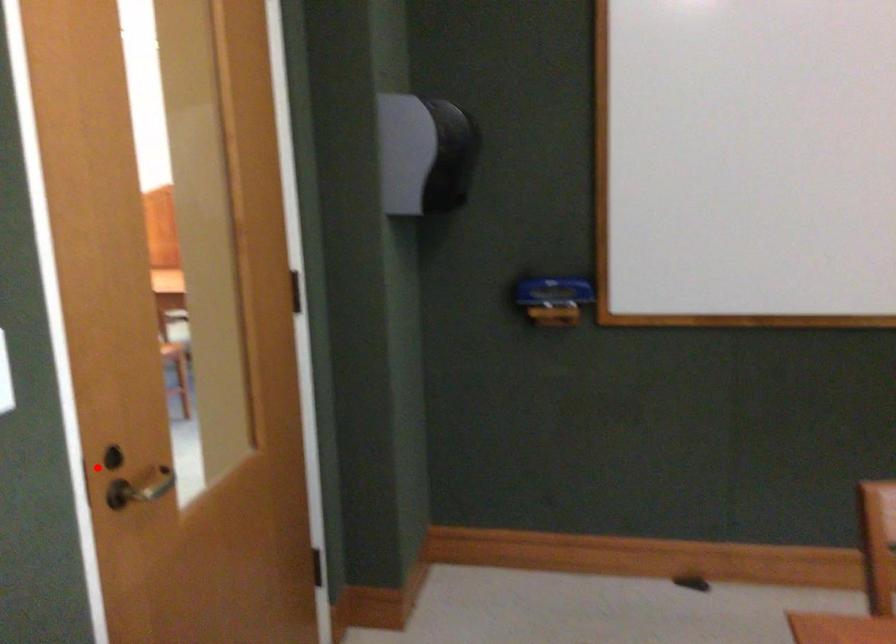
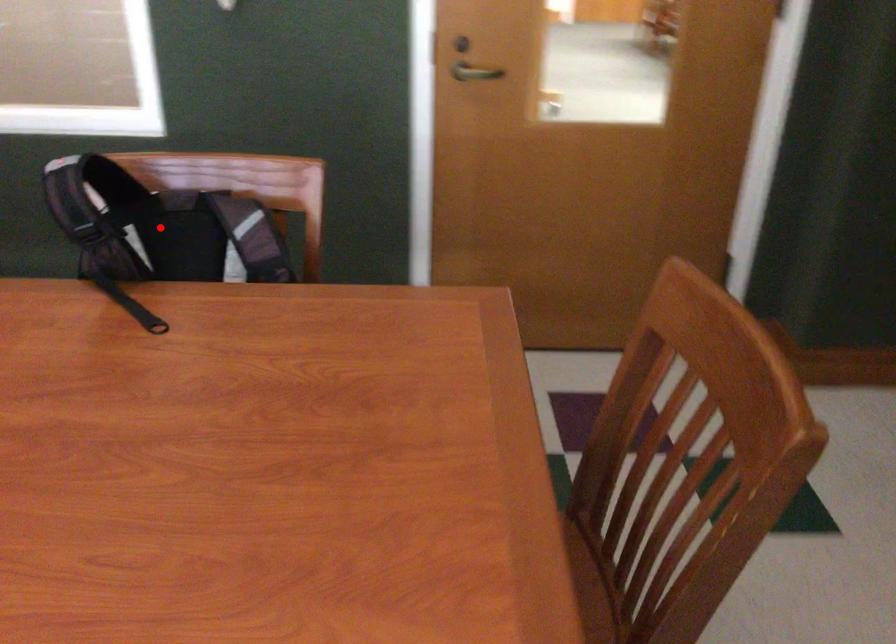
I am providing you with two images of the same scene from different viewpoints. A red point is marked on the first image and another point is marked on the second image. Does the point marked in image1 correspond to the same location as the one in image2?

No